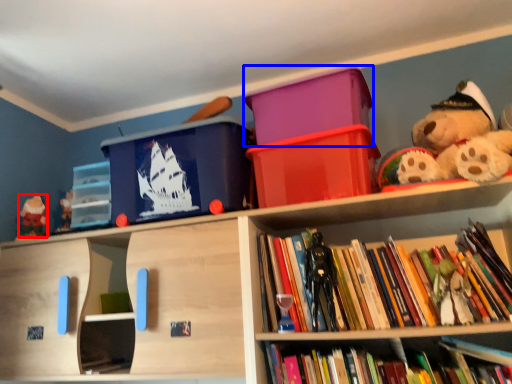
Question: Which point is further to the camera, toy (highlighted by a red box) or storage box (highlighted by a blue box)?

Choices:
 (A) toy
 (B) storage box

Answer: (A)